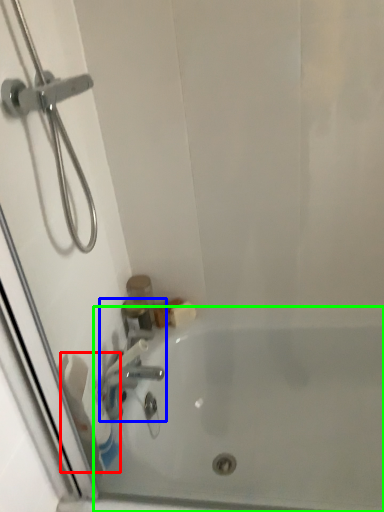
Question: Which object is the closest to the toilet paper (highlighted by a red box)? Choose among these: tap (highlighted by a blue box) or bathtub (highlighted by a green box).

Choices:
 (A) tap
 (B) bathtub

Answer: (A)